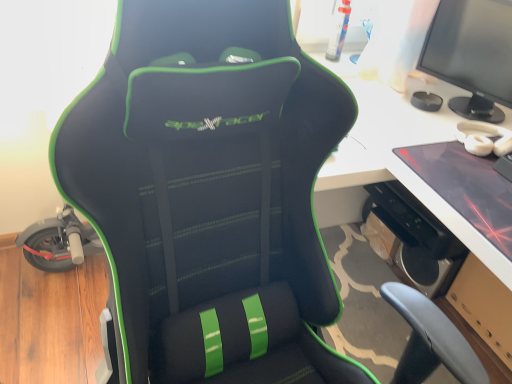
Question: Does black matte speaker at lower right have a larger size compared to matte black monitor at upper right?

Choices:
 (A) yes
 (B) no

Answer: (B)

Question: Can you confirm if black matte speaker at lower right is taller than matte black monitor at upper right?

Choices:
 (A) no
 (B) yes

Answer: (A)

Question: Is black matte speaker at lower right oriented towards matte black monitor at upper right?

Choices:
 (A) no
 (B) yes

Answer: (A)

Question: From a real-world perspective, is black matte speaker at lower right located beneath matte black monitor at upper right?

Choices:
 (A) yes
 (B) no

Answer: (A)

Question: Are black matte speaker at lower right and matte black monitor at upper right located far from each other?

Choices:
 (A) yes
 (B) no

Answer: (B)

Question: Relative to black matte speaker at lower right, is white glossy computer desk at center in front or behind?

Choices:
 (A) front
 (B) behind

Answer: (A)

Question: In terms of width, does white glossy computer desk at center look wider or thinner when compared to black matte speaker at lower right?

Choices:
 (A) thin
 (B) wide

Answer: (B)

Question: Is white glossy computer desk at center taller or shorter than black matte speaker at lower right?

Choices:
 (A) tall
 (B) short

Answer: (A)

Question: From a real-world perspective, relative to black matte speaker at lower right, is white glossy computer desk at center vertically above or below?

Choices:
 (A) below
 (B) above

Answer: (B)

Question: Looking at the image, does white glossy computer desk at center seem bigger or smaller compared to matte black laptop at right?

Choices:
 (A) big
 (B) small

Answer: (A)

Question: From a real-world perspective, relative to matte black laptop at right, is white glossy computer desk at center vertically above or below?

Choices:
 (A) below
 (B) above

Answer: (A)

Question: Looking at their shapes, would you say white glossy computer desk at center is wider or thinner than matte black laptop at right?

Choices:
 (A) wide
 (B) thin

Answer: (A)

Question: Is white glossy computer desk at center in front of or behind matte black laptop at right in the image?

Choices:
 (A) front
 (B) behind

Answer: (A)

Question: In the image, is black matte speaker at lower right positioned in front of or behind matte black monitor at upper right?

Choices:
 (A) front
 (B) behind

Answer: (B)

Question: Would you say black matte speaker at lower right is inside or outside matte black monitor at upper right?

Choices:
 (A) inside
 (B) outside

Answer: (B)